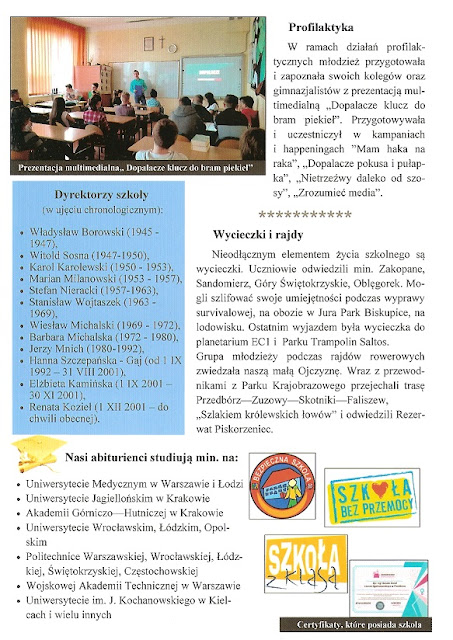
This screenshot has width=453, height=640. In order to click on diploma in this screenshot , I will do `click(28, 468)`.